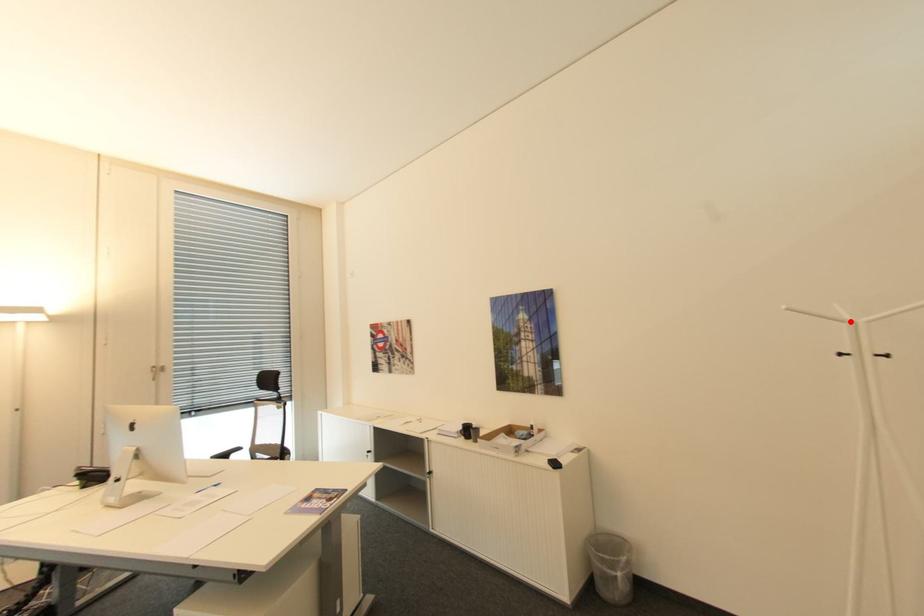
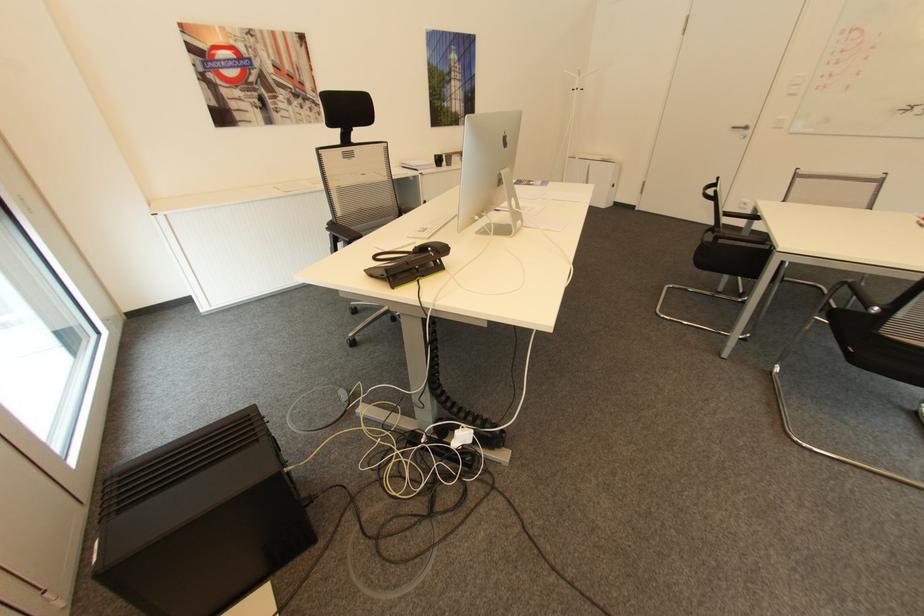
Question: I am providing you with two images of the same scene from different viewpoints. Image1 has a red point marked. In image2, the corresponding 3D location appears at what relative position? Reply with the corresponding letter.

Choices:
 (A) Closer
 (B) Farther

Answer: (A)